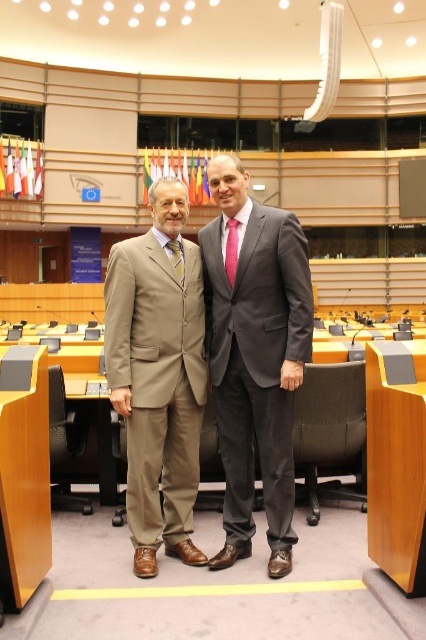
Is tan fabric suit at center closer to camera compared to pink satin tie at center?

Yes, it is.

This screenshot has width=426, height=640. Identify the location of tan fabric suit at center. (158, 378).

Does matte beige suit at center come in front of pink satin tie at center?

Yes, it is.

Between matte beige suit at center and pink satin tie at center, which one has less height?

pink satin tie at center

What do you see at coordinates (255, 356) in the screenshot? The width and height of the screenshot is (426, 640). I see `matte beige suit at center` at bounding box center [255, 356].

I want to click on matte beige suit at center, so click(255, 356).

Is point (307, 284) positioned behind point (175, 237)?

That is False.

Can you confirm if matte beige suit at center is positioned to the left of yellowtextured fabrictie at center?

Result: No, matte beige suit at center is not to the left of yellowtextured fabrictie at center.

Is point (276, 492) behind point (178, 260)?

No, (276, 492) is in front of (178, 260).

You are a GUI agent. You are given a task and a screenshot of the screen. Output one action in this format:
    pyautogui.click(x=<x>, y=<y>)
    Task: Click on the matte beige suit at center
    
    Given the screenshot: What is the action you would take?
    pyautogui.click(x=255, y=356)